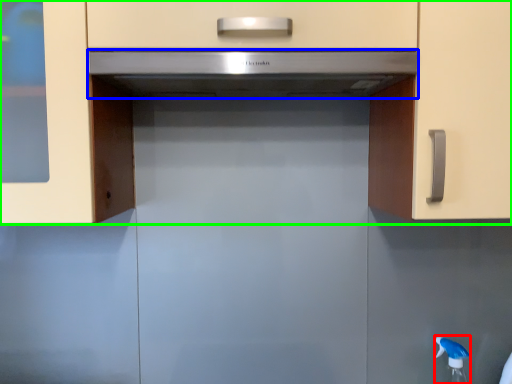
Question: Which is farther away from faucet (highlighted by a red box)? home appliance (highlighted by a blue box) or cabinetry (highlighted by a green box)?

Choices:
 (A) home appliance
 (B) cabinetry

Answer: (A)